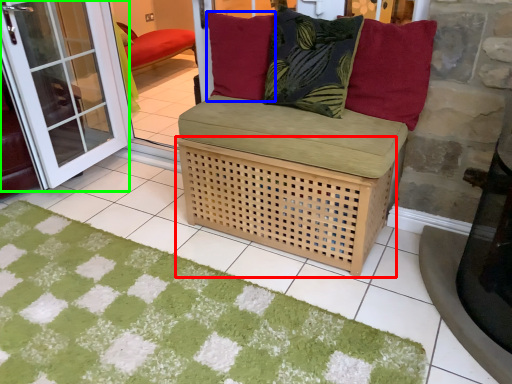
Question: Which is farther away from basket (highlighted by a red box)? pillow (highlighted by a blue box) or screen door (highlighted by a green box)?

Choices:
 (A) pillow
 (B) screen door

Answer: (B)